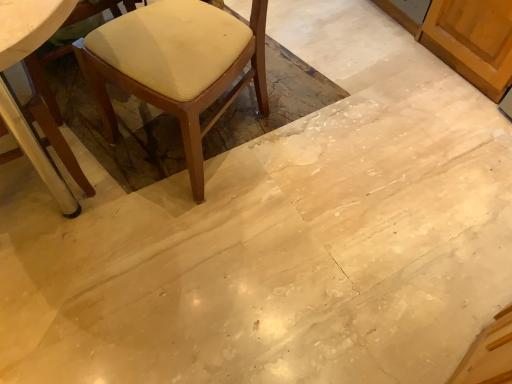
I want to click on vacant space underneath matte beige cushioned chair at left, arranged as the first chair when viewed from the right (from a real-world perspective), so click(x=213, y=139).